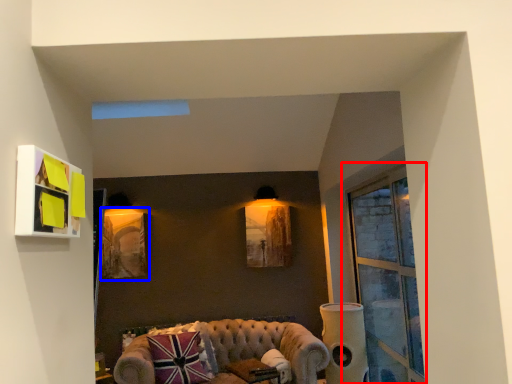
Question: Among these objects, which one is nearest to the camera, window (highlighted by a red box) or picture frame (highlighted by a blue box)?

Choices:
 (A) window
 (B) picture frame

Answer: (A)